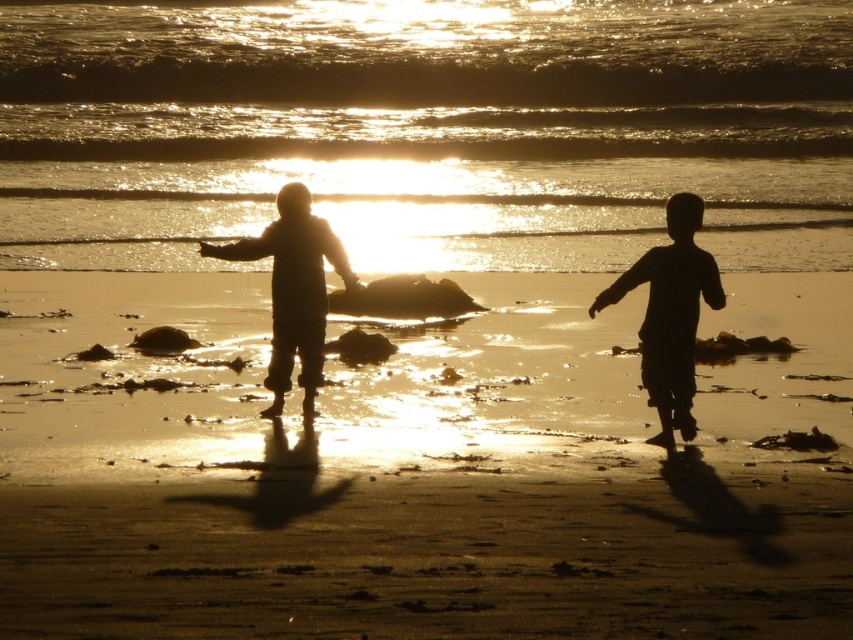
Does silhouette child at right have a smaller size compared to silhouette figure at center?

No.

Is silhouette child at right closer to camera compared to silhouette figure at center?

That is True.

The width and height of the screenshot is (853, 640). I want to click on silhouette child at right, so click(x=670, y=314).

Identify the location of silhouette child at right. This screenshot has width=853, height=640. (670, 314).

Which of these two, smooth sand at center or silhouette figure at center, stands shorter?

Standing shorter between the two is silhouette figure at center.

Describe the element at coordinates (415, 477) in the screenshot. I see `smooth sand at center` at that location.

This screenshot has height=640, width=853. I want to click on smooth sand at center, so click(415, 477).

At what (x,y) coordinates should I click in order to perform the action: click on smooth sand at center. Please return your answer as a coordinate pair (x, y). The height and width of the screenshot is (640, 853). Looking at the image, I should click on (415, 477).

Between golden reflective water at center and silhouette figure at center, which one has less height?

With less height is silhouette figure at center.

Does golden reflective water at center have a larger size compared to silhouette figure at center?

Correct, golden reflective water at center is larger in size than silhouette figure at center.

Between point (624, 56) and point (273, 310), which one is positioned in front?

Positioned in front is point (273, 310).

Where is `golden reflective water at center`? The width and height of the screenshot is (853, 640). golden reflective water at center is located at coordinates (427, 129).